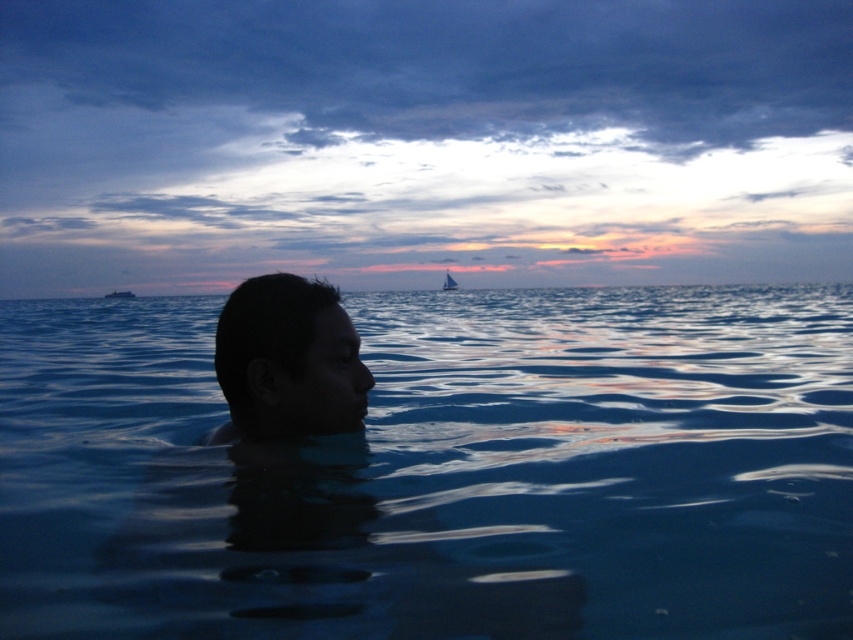
You are a photographer trying to capture the sunset scene. You notice the transparent blue water at center and the white plastic boat at center. Which object in the scene is bigger?

The transparent blue water at center is larger in size compared to the white plastic boat at center.

You are standing at the point labeled point (619,298) and want to walk to the point labeled point (109,298). Which direction should you move in to get there?

You should move downward because point (619,298) is closer to the viewer than point (109,298), so the latter is located further away from you in the vertical direction.